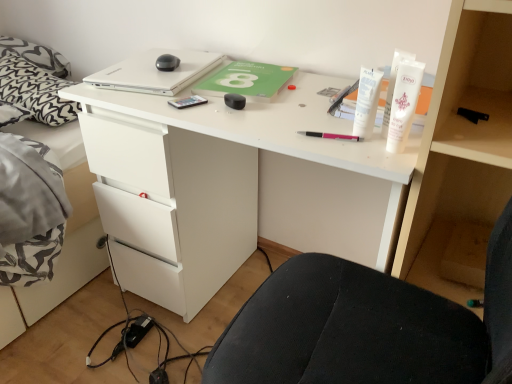
I want to click on vacant space in between satin silver phone at center, the 1th stationery when ordered from back to front, and white matte tube at upper right, the second toiletry viewed from the right, so click(x=262, y=119).